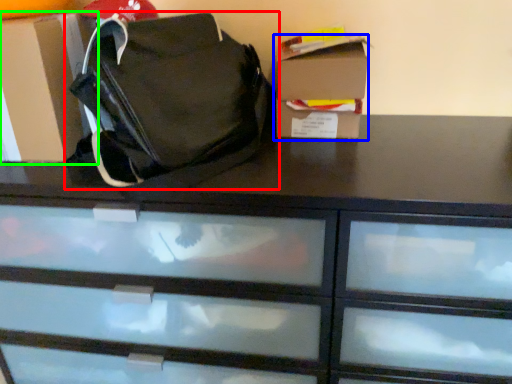
Question: Which object is the farthest from handbag (highlighted by a red box)? Choose among these: storage box (highlighted by a blue box) or cardboard box (highlighted by a green box).

Choices:
 (A) storage box
 (B) cardboard box

Answer: (A)